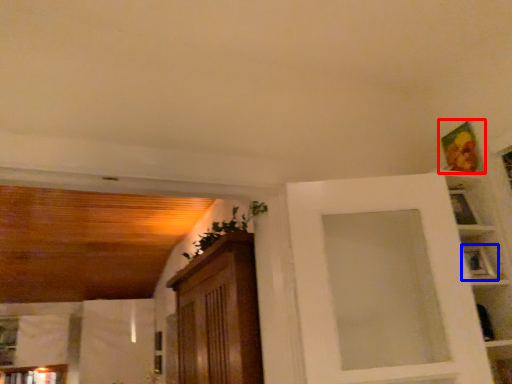
Question: Which of the following is the closest to the observer, picture frame (highlighted by a red box) or picture frame (highlighted by a blue box)?

Choices:
 (A) picture frame
 (B) picture frame

Answer: (B)